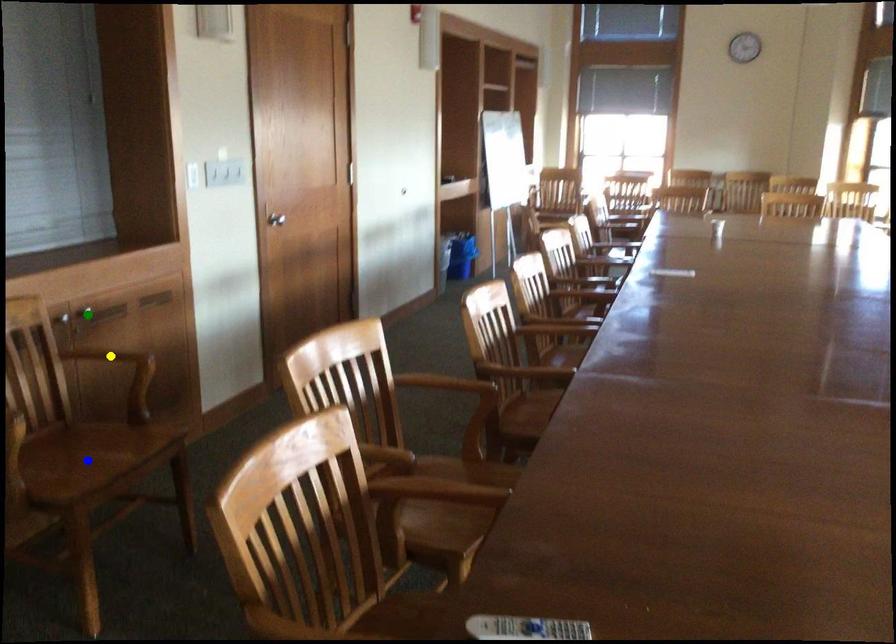
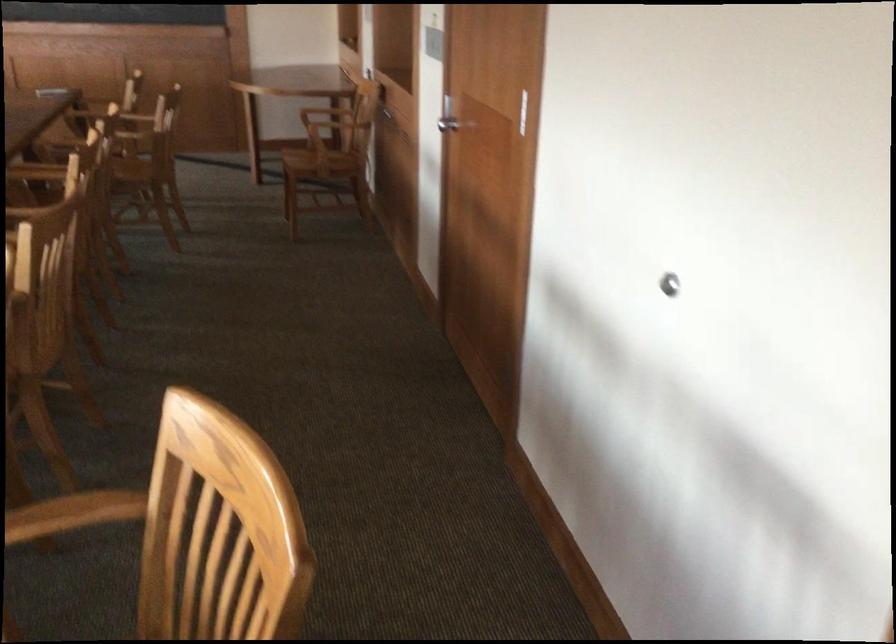
I am providing you with two images of the same scene from different viewpoints. Three points are marked in image1. Which point corresponds to a part or object that is occluded in image2?In image1, three points are marked. Which of them correspond to a part or object that is occluded in image2?Among the three points shown in image1, which one corresponds to a part or object that is no longer visible due to occlusion in image2?

blue point, green point, yellow point